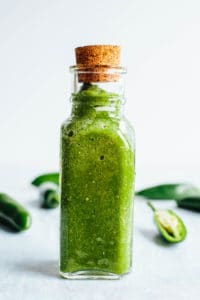
Locate an element on the screen. table is located at coordinates (154, 262).